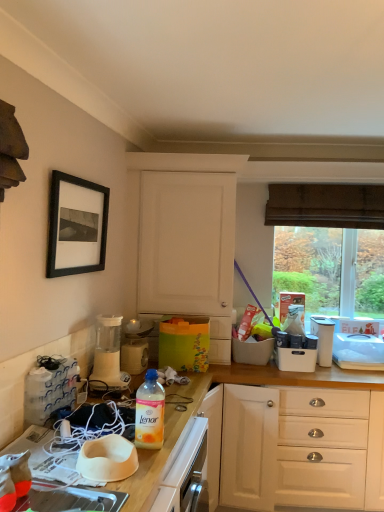
Question: Should I look upward or downward to see white plastic container at upper right, which ranks as the fourth appliance in left-to-right order?

Choices:
 (A) up
 (B) down

Answer: (B)

Question: Considering the relative sizes of white plastic blender at center, the 3th appliance viewed from the front, and white plastic container at upper right, which ranks as the fourth appliance in left-to-right order, in the image provided, is white plastic blender at center, the 3th appliance viewed from the front, wider than white plastic container at upper right, which ranks as the fourth appliance in left-to-right order,?

Choices:
 (A) yes
 (B) no

Answer: (B)

Question: Is white plastic blender at center, the second appliance positioned from the back, surrounding white plastic container at upper right, the 1th appliance from the right?

Choices:
 (A) no
 (B) yes

Answer: (A)

Question: Is white plastic blender at center, the 3th appliance viewed from the front, positioned far away from white plastic container at upper right, which ranks as the fourth appliance in left-to-right order?

Choices:
 (A) yes
 (B) no

Answer: (A)

Question: Is white plastic blender at center, acting as the third appliance starting from the left, to the left of white plastic container at upper right, the 4th appliance positioned from the front, from the viewer's perspective?

Choices:
 (A) yes
 (B) no

Answer: (A)

Question: Can you confirm if white plastic blender at center, acting as the third appliance starting from the left, is taller than white plastic container at upper right, the 4th appliance positioned from the front?

Choices:
 (A) yes
 (B) no

Answer: (B)

Question: Is white plastic blender at center, the 3th appliance viewed from the front, looking in the opposite direction of white plastic container at upper right, which is the 1th appliance from back to front?

Choices:
 (A) yes
 (B) no

Answer: (B)

Question: From a real-world perspective, is white matte bowl at center on black matte picture frame at upper left?

Choices:
 (A) yes
 (B) no

Answer: (B)

Question: Can you confirm if white matte bowl at center is thinner than black matte picture frame at upper left?

Choices:
 (A) yes
 (B) no

Answer: (B)

Question: Can you confirm if white matte bowl at center is smaller than black matte picture frame at upper left?

Choices:
 (A) no
 (B) yes

Answer: (B)

Question: Can you confirm if white matte bowl at center is wider than black matte picture frame at upper left?

Choices:
 (A) no
 (B) yes

Answer: (B)

Question: Is white matte bowl at center further to the viewer compared to black matte picture frame at upper left?

Choices:
 (A) yes
 (B) no

Answer: (B)

Question: Is white matte bowl at center shorter than black matte picture frame at upper left?

Choices:
 (A) yes
 (B) no

Answer: (A)

Question: Can you confirm if transparent glass window at upper right is smaller than white matte cabinet at center?

Choices:
 (A) no
 (B) yes

Answer: (B)